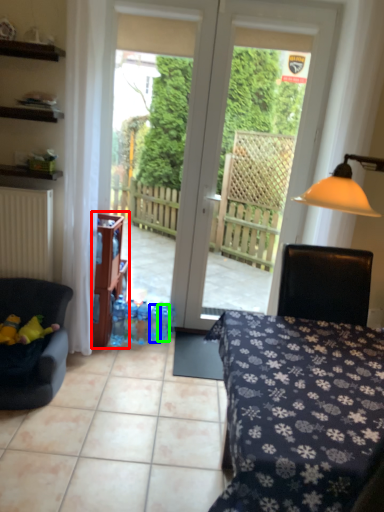
Question: Which object is positioned closest to shelf (highlighted by a red box)? Select from bottle (highlighted by a blue box) and bottle (highlighted by a green box).

Choices:
 (A) bottle
 (B) bottle

Answer: (A)